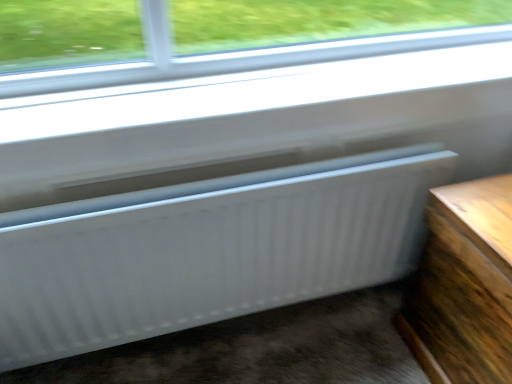
This screenshot has width=512, height=384. I want to click on wooden table at lower right, so coord(464,286).

The width and height of the screenshot is (512, 384). What do you see at coordinates (464, 286) in the screenshot?
I see `wooden table at lower right` at bounding box center [464, 286].

In order to face wooden table at lower right, should I rotate leftwards or rightwards?

You should rotate right by 32.536 degrees.

Find the location of `white ribbed radiator at lower center`. white ribbed radiator at lower center is located at coordinates (207, 251).

Measure the distance between white ribbed radiator at lower center and camera.

white ribbed radiator at lower center and camera are 38.86 inches apart from each other.

The image size is (512, 384). Describe the element at coordinates (207, 251) in the screenshot. I see `white ribbed radiator at lower center` at that location.

Identify the location of wooden table at lower right. (464, 286).

Is white ribbed radiator at lower center to the left or to the right of wooden table at lower right in the image?

From the image, it's evident that white ribbed radiator at lower center is to the left of wooden table at lower right.

Is white ribbed radiator at lower center closer to camera compared to wooden table at lower right?

No, white ribbed radiator at lower center is behind wooden table at lower right.

Is point (105, 341) closer or farther from the camera than point (416, 341)?

Point (105, 341) is positioned closer to the camera compared to point (416, 341).

From the image's perspective, which one is positioned lower, white ribbed radiator at lower center or wooden table at lower right?

wooden table at lower right.

From a real-world perspective, does white ribbed radiator at lower center sit lower than wooden table at lower right?

No, from a real-world perspective, white ribbed radiator at lower center is not beneath wooden table at lower right.

Based on the photo, which of these two, white ribbed radiator at lower center or wooden table at lower right, is wider?

wooden table at lower right.

Can you confirm if white ribbed radiator at lower center is taller than wooden table at lower right?

No.

Considering the relative sizes of white ribbed radiator at lower center and wooden table at lower right in the image provided, is white ribbed radiator at lower center smaller than wooden table at lower right?

Indeed, white ribbed radiator at lower center has a smaller size compared to wooden table at lower right.

Which is correct: white ribbed radiator at lower center is inside wooden table at lower right, or outside of it?

white ribbed radiator at lower center is spatially situated outside wooden table at lower right.

Is white ribbed radiator at lower center positioned far away from wooden table at lower right?

No.

Is white ribbed radiator at lower center facing towards wooden table at lower right?

Yes, white ribbed radiator at lower center is oriented towards wooden table at lower right.

How different are the orientations of white ribbed radiator at lower center and wooden table at lower right in degrees?

The angle between the facing direction of white ribbed radiator at lower center and the facing direction of wooden table at lower right is 89.9 degrees.

Find the location of a particular element. The height and width of the screenshot is (384, 512). furniture below the white ribbed radiator at lower center (from a real-world perspective) is located at coordinates (464, 286).

In the image, is wooden table at lower right on the left side or the right side of white ribbed radiator at lower center?

Clearly, wooden table at lower right is on the right of white ribbed radiator at lower center in the image.

Considering their positions, is wooden table at lower right located in front of or behind white ribbed radiator at lower center?

wooden table at lower right is in front of white ribbed radiator at lower center.

Does point (450, 327) come in front of point (408, 150)?

Yes, point (450, 327) is closer to viewer.

From the image's perspective, is wooden table at lower right below white ribbed radiator at lower center?

Yes, from the image's perspective, wooden table at lower right is below white ribbed radiator at lower center.

From a real-world perspective, is wooden table at lower right physically above white ribbed radiator at lower center?

No.

Does wooden table at lower right have a greater width compared to white ribbed radiator at lower center?

Yes.

Can you confirm if wooden table at lower right is shorter than white ribbed radiator at lower center?

Incorrect, the height of wooden table at lower right does not fall short of that of white ribbed radiator at lower center.

Is wooden table at lower right bigger or smaller than white ribbed radiator at lower center?

In the image, wooden table at lower right appears to be larger than white ribbed radiator at lower center.

Would you say wooden table at lower right is inside or outside white ribbed radiator at lower center?

wooden table at lower right is outside white ribbed radiator at lower center.

Does wooden table at lower right touch white ribbed radiator at lower center?

No, wooden table at lower right is not making contact with white ribbed radiator at lower center.

Is wooden table at lower right turned away from white ribbed radiator at lower center?

No, wooden table at lower right is not facing the opposite direction of white ribbed radiator at lower center.

Measure the distance between wooden table at lower right and white ribbed radiator at lower center.

wooden table at lower right is 17.38 inches from white ribbed radiator at lower center.

In order to click on furniture below the white ribbed radiator at lower center (from a real-world perspective) in this screenshot , I will do `click(464, 286)`.

Where is `furniture to the right of white ribbed radiator at lower center`? Image resolution: width=512 pixels, height=384 pixels. furniture to the right of white ribbed radiator at lower center is located at coordinates (464, 286).

Find the location of a particular element. furniture lying below the white ribbed radiator at lower center (from the image's perspective) is located at coordinates (464, 286).